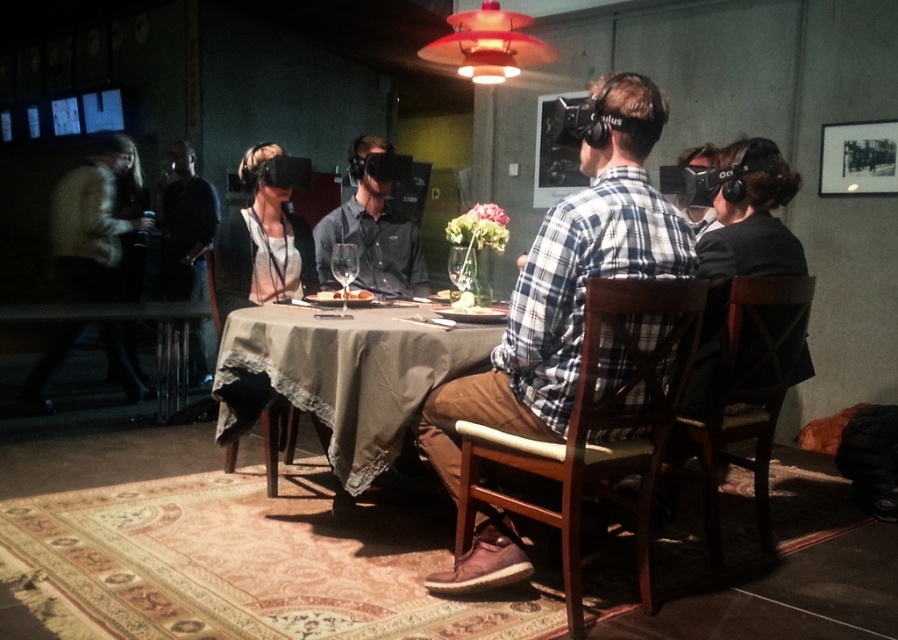
Question: Is matte black shirt at center wider than black leather jacket at left?

Choices:
 (A) no
 (B) yes

Answer: (A)

Question: Which point is closer to the camera taking this photo?

Choices:
 (A) (364, 256)
 (B) (539, 241)

Answer: (B)

Question: Is plaid shirt at center wider than light beige sweater at left?

Choices:
 (A) no
 (B) yes

Answer: (B)

Question: Which point is farther from the camera taking this photo?

Choices:
 (A) (361, 243)
 (B) (166, 188)
 (C) (518, 305)

Answer: (B)

Question: Which object is farther from the camera taking this photo?

Choices:
 (A) brown fabric table at center
 (B) plaid shirt at center

Answer: (A)

Question: Can you confirm if light beige sweater at left is wider than matte black shirt at center?

Choices:
 (A) no
 (B) yes

Answer: (B)